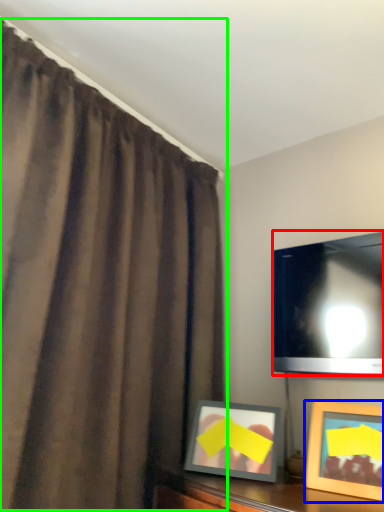
Question: Considering the real-world distances, which object is closest to television (highlighted by a red box)? picture frame (highlighted by a blue box) or curtain (highlighted by a green box).

Choices:
 (A) picture frame
 (B) curtain

Answer: (A)